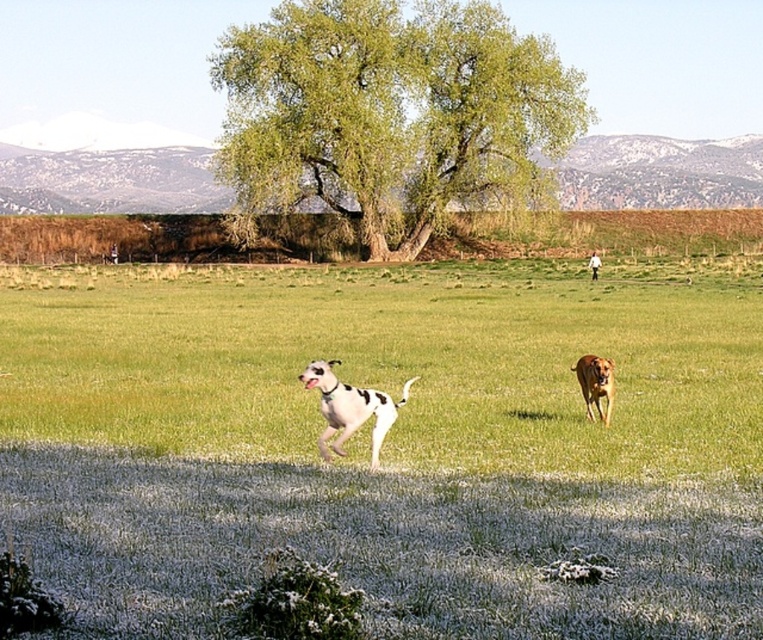
You are standing in the field and see two points marked in the image. Which point is closer to you, point (x=420, y=61) or point (x=340, y=400)?

Point (x=420, y=61) is further to the camera than point (x=340, y=400), so the point closer to you is point (x=340, y=400).

You are a photographer wanting to capture the golden brown fur at right clearly while ensuring the green grass at center is still visible in the background. Which part of the image should you focus on to achieve this?

The photographer should focus on the golden brown fur at right since it is smaller in size compared to the green grass at center, allowing the background grass to remain visible while keeping the fur in focus.